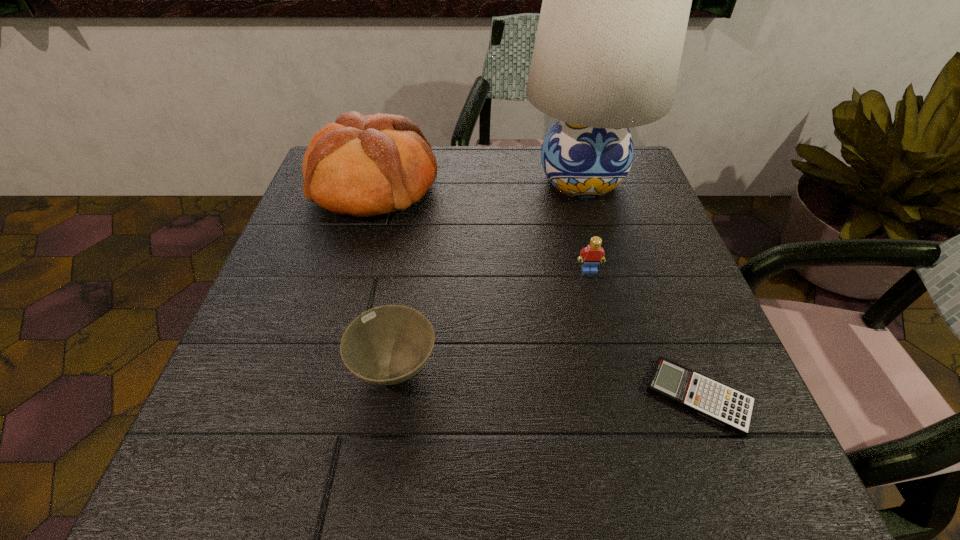
Where is `lampshade situated at the far edge`? This screenshot has height=540, width=960. lampshade situated at the far edge is located at coordinates (616, 1).

At what (x,y) coordinates should I click in order to perform the action: click on bread that is at the far edge. Please return your answer as a coordinate pair (x, y). The image size is (960, 540). Looking at the image, I should click on (364, 166).

At what (x,y) coordinates should I click in order to perform the action: click on object present at the near edge. Please return your answer as a coordinate pair (x, y). The height and width of the screenshot is (540, 960). Looking at the image, I should click on (723, 405).

In order to click on object that is positioned at the left edge in this screenshot , I will do `click(364, 166)`.

What are the coordinates of `lampshade that is at the right edge` in the screenshot? It's located at (616, 1).

Locate an element on the screen. calculator located in the right edge section of the desktop is located at coordinates (723, 405).

I want to click on object situated at the far left corner, so click(x=364, y=166).

You are a GUI agent. You are given a task and a screenshot of the screen. Output one action in this format:
    pyautogui.click(x=<x>, y=<y>)
    Task: Click on the object that is at the far right corner
    This screenshot has height=540, width=960.
    Given the screenshot: What is the action you would take?
    pyautogui.click(x=616, y=1)

Find the location of a particular element. The image size is (960, 540). object at the near right corner is located at coordinates (723, 405).

In the image, there is a desktop. At what (x,y) coordinates should I click in order to perform the action: click on vacant space at the far edge. Please return your answer as a coordinate pair (x, y). Looking at the image, I should click on (452, 155).